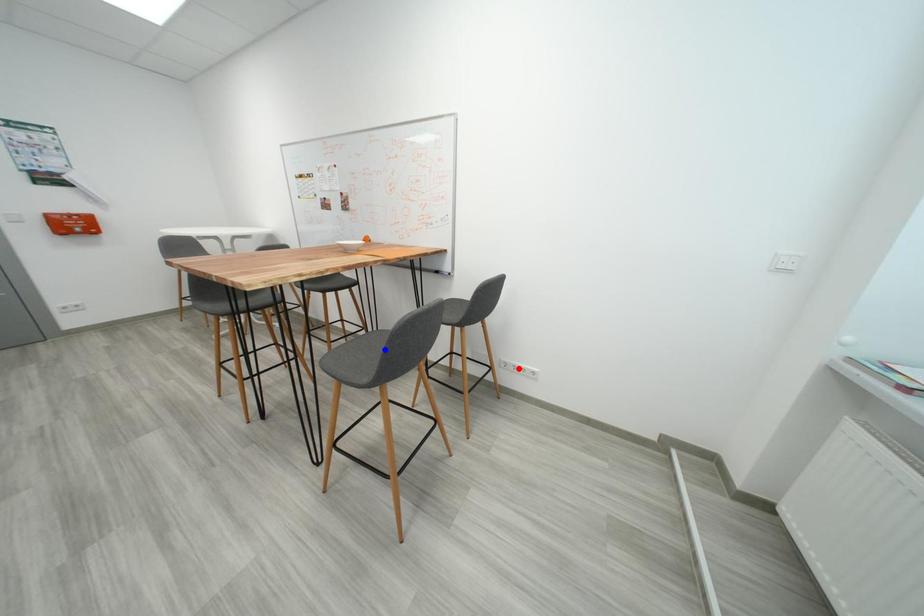
Question: Two points are marked on the image. Which point is closer to the camera?

Choices:
 (A) Blue point is closer.
 (B) Red point is closer.

Answer: (A)